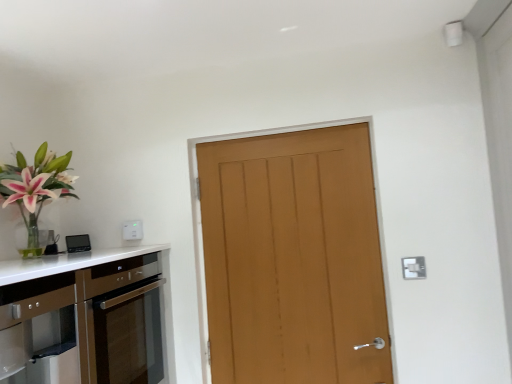
Identify the location of free point above wooden door at center (from a real-world perspective). (269, 130).